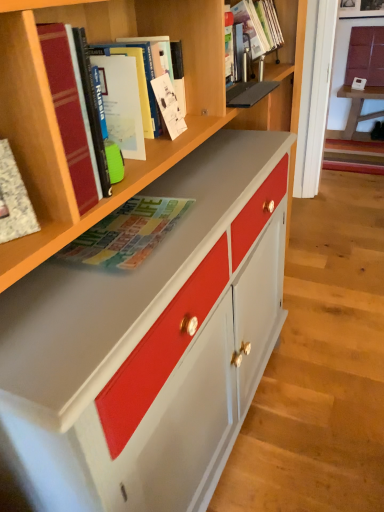
Question: Is hardcover book at upper left, positioned as the second book in front-to-back order, outside white textured notebook at left, which is counted as the 1th book, starting from the front?

Choices:
 (A) yes
 (B) no

Answer: (A)

Question: Is hardcover book at upper left, which ranks as the 5th book in back-to-front order, at the left side of white textured notebook at left, which is counted as the 1th book, starting from the front?

Choices:
 (A) yes
 (B) no

Answer: (B)

Question: Is hardcover book at upper left, positioned as the second book in front-to-back order, positioned with its back to white textured notebook at left, which is the 6th book from back to front?

Choices:
 (A) yes
 (B) no

Answer: (B)

Question: Considering the relative sizes of hardcover book at upper left, positioned as the second book in front-to-back order, and white textured notebook at left, which is the 6th book from back to front, in the image provided, is hardcover book at upper left, positioned as the second book in front-to-back order, shorter than white textured notebook at left, which is the 6th book from back to front,?

Choices:
 (A) yes
 (B) no

Answer: (B)

Question: Does hardcover book at upper left, positioned as the second book in front-to-back order, have a lesser width compared to white textured notebook at left, which is the 6th book from back to front?

Choices:
 (A) no
 (B) yes

Answer: (A)

Question: Is hardcover book at upper left, which ranks as the 5th book in back-to-front order, taller than white textured notebook at left, which is the 6th book from back to front?

Choices:
 (A) yes
 (B) no

Answer: (A)

Question: Considering the relative positions of hardcover book at upper left, which ranks as the 5th book in back-to-front order, and matte plastic book at upper center, which is the 6th book from front to back, in the image provided, is hardcover book at upper left, which ranks as the 5th book in back-to-front order, in front of matte plastic book at upper center, which is the 6th book from front to back,?

Choices:
 (A) no
 (B) yes

Answer: (B)

Question: Is hardcover book at upper left, positioned as the second book in front-to-back order, next to matte plastic book at upper center, the first book positioned from the back?

Choices:
 (A) yes
 (B) no

Answer: (B)

Question: Does hardcover book at upper left, positioned as the second book in front-to-back order, come behind matte plastic book at upper center, which is the 6th book from front to back?

Choices:
 (A) yes
 (B) no

Answer: (B)

Question: From a real-world perspective, is hardcover book at upper left, which ranks as the 5th book in back-to-front order, located beneath matte plastic book at upper center, which is the 6th book from front to back?

Choices:
 (A) yes
 (B) no

Answer: (A)

Question: Does hardcover book at upper left, positioned as the second book in front-to-back order, have a larger size compared to matte plastic book at upper center, the first book positioned from the back?

Choices:
 (A) yes
 (B) no

Answer: (A)

Question: From the image's perspective, is hardcover book at upper left, positioned as the second book in front-to-back order, on matte plastic book at upper center, the first book positioned from the back?

Choices:
 (A) yes
 (B) no

Answer: (B)

Question: Considering the relative sizes of matte white cabinet at upper right and matte magazine at center, positioned as the third book in front-to-back order, in the image provided, is matte white cabinet at upper right shorter than matte magazine at center, positioned as the third book in front-to-back order,?

Choices:
 (A) yes
 (B) no

Answer: (B)